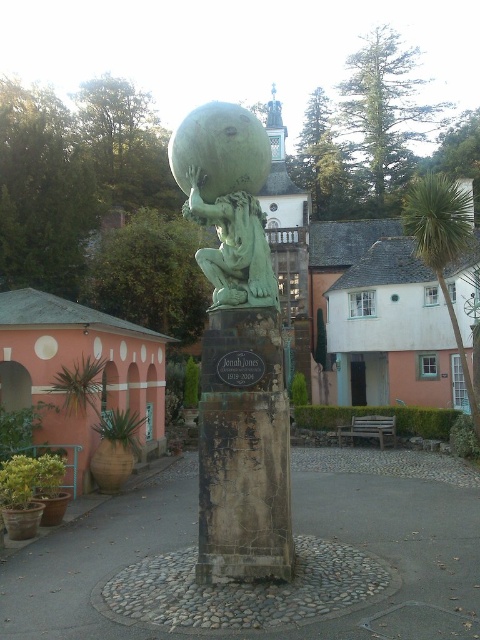
You are standing in the outdoor area and want to take a photo of the green stone statue at center without any obstructions. Is the green leafy palm tree at upper right blocking the view of the statue?

The green stone statue at center is below the green leafy palm tree at upper right, so the palm tree may block part of the statue when taking a photo from this angle.

Based on the photo, you are an artist planning to sketch this scene. You want to ensure that the green stone statue at center and the green leafy palm tree at upper right are proportionally accurate. Which object should you draw smaller in your sketch?

The green stone statue at center should be drawn smaller because it occupies less space than the green leafy palm tree at upper right.